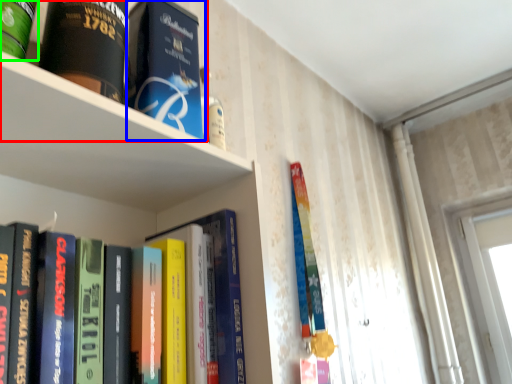
Question: Which is farther away from book (highlighted by a red box)? book (highlighted by a blue box) or book (highlighted by a green box)?

Choices:
 (A) book
 (B) book

Answer: (B)